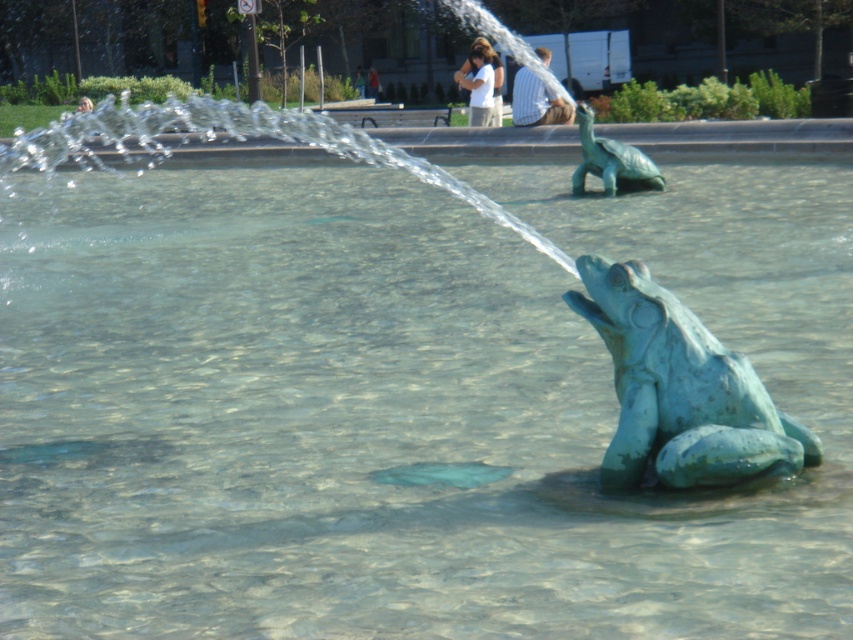
Where is `green patina frog at center`? green patina frog at center is located at coordinates (680, 388).

Is green patina frog at center to the right of green patina turtle at upper center from the viewer's perspective?

Incorrect, green patina frog at center is not on the right side of green patina turtle at upper center.

Which is in front, point (656, 404) or point (612, 188)?

Point (656, 404) is in front.

Locate an element on the screen. The height and width of the screenshot is (640, 853). green patina frog at center is located at coordinates (680, 388).